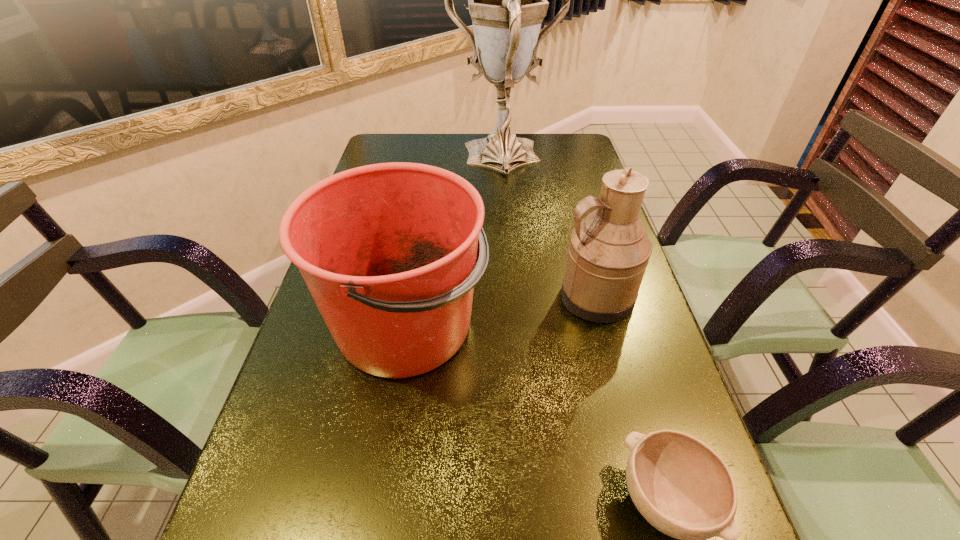
The width and height of the screenshot is (960, 540). Find the location of `pitcher that is at the right edge`. pitcher that is at the right edge is located at coordinates click(x=608, y=253).

The image size is (960, 540). Identify the location of object that is at the far right corner. (507, 0).

The image size is (960, 540). I want to click on vacant space at the far edge of the desktop, so click(x=471, y=136).

You are a GUI agent. You are given a task and a screenshot of the screen. Output one action in this format:
    pyautogui.click(x=<x>, y=<y>)
    Task: Click on the vacant space at the left edge
    
    Given the screenshot: What is the action you would take?
    pyautogui.click(x=319, y=350)

You are a GUI agent. You are given a task and a screenshot of the screen. Output one action in this format:
    pyautogui.click(x=<x>, y=<y>)
    Task: Click on the blank space at the right edge
    The height and width of the screenshot is (540, 960).
    Given the screenshot: What is the action you would take?
    pyautogui.click(x=617, y=491)

Identify the location of vacant position at the far right corner of the desktop. (540, 144).

Find the location of a particular element. free point between the bucket and the pitcher is located at coordinates (500, 312).

In order to click on vacant region between the bucket and the pitcher in this screenshot , I will do `click(500, 312)`.

Identify the location of vacant point located between the pitcher and the bucket. (500, 312).

Image resolution: width=960 pixels, height=540 pixels. What are the coordinates of `free space that is in between the pitcher and the trophy cup` in the screenshot? It's located at (550, 227).